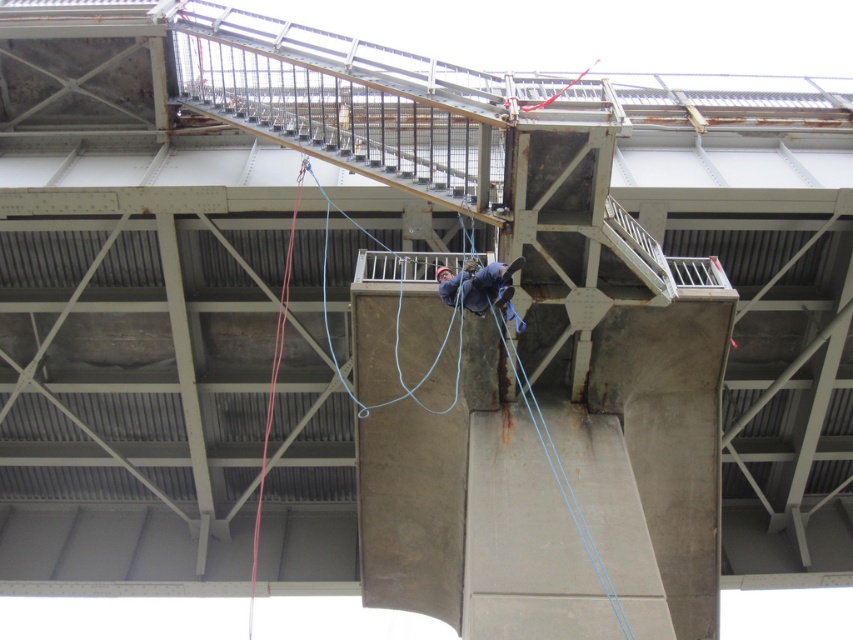
You are a safety inspector assessing the setup of the worker in the image. The safety guidelines require that the distance between the red nylon rope at center and the blue fabric harness at center must not exceed 5 meters. Is the current setup compliant with the safety guidelines?

The distance between the red nylon rope at center and the blue fabric harness at center is 6.23 meters, which exceeds the 5 meters limit set by the safety guidelines. Therefore, the current setup is not compliant with the safety guidelines.